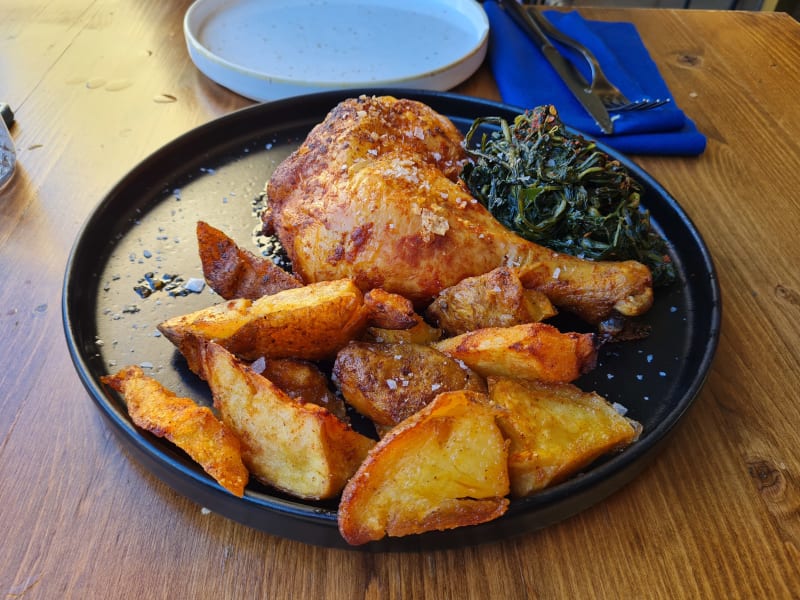
Where is `plate`? This screenshot has height=600, width=800. plate is located at coordinates (122, 311).